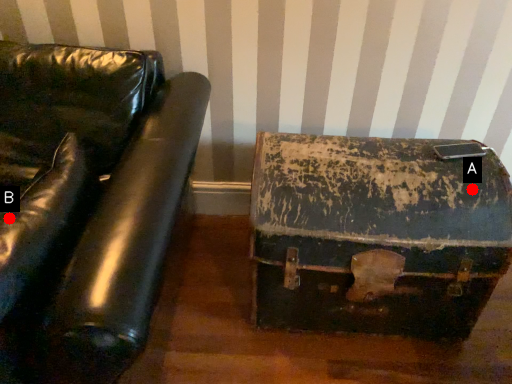
Question: Two points are circled on the image, labeled by A and B beside each circle. Among these points, which one is farthest from the camera?

Choices:
 (A) A is further
 (B) B is further

Answer: (A)